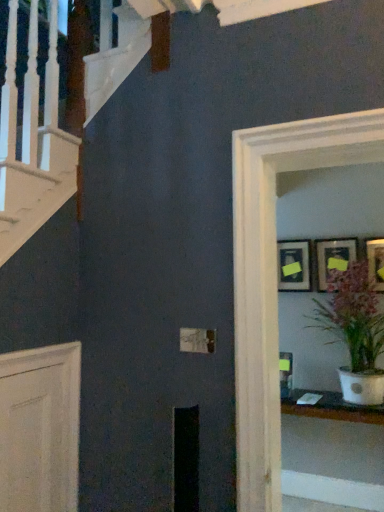
Question: Does matte black picture frame at upper right, which is the first picture frame from left to right, contain white glossy pot at center-right?

Choices:
 (A) yes
 (B) no

Answer: (B)

Question: Does matte black picture frame at upper right, which is the first picture frame from left to right, come behind white glossy pot at center-right?

Choices:
 (A) no
 (B) yes

Answer: (B)

Question: Considering the relative sizes of matte black picture frame at upper right, which is the first picture frame from left to right, and white glossy pot at center-right in the image provided, is matte black picture frame at upper right, which is the first picture frame from left to right, taller than white glossy pot at center-right?

Choices:
 (A) yes
 (B) no

Answer: (B)

Question: Considering the relative sizes of matte black picture frame at upper right, which is the first picture frame from left to right, and white glossy pot at center-right in the image provided, is matte black picture frame at upper right, which is the first picture frame from left to right, wider than white glossy pot at center-right?

Choices:
 (A) no
 (B) yes

Answer: (A)

Question: Are matte black picture frame at upper right, which is the first picture frame from left to right, and white glossy pot at center-right far apart?

Choices:
 (A) no
 (B) yes

Answer: (A)

Question: Does matte black picture frame at upper right, acting as the 3th picture frame starting from the right, have a lesser width compared to white glossy pot at center-right?

Choices:
 (A) no
 (B) yes

Answer: (B)

Question: From a real-world perspective, is white glossy glass door at upper right located beneath matte black picture frame at upper right, which is the first picture frame from left to right?

Choices:
 (A) yes
 (B) no

Answer: (A)

Question: Considering the relative positions of white glossy glass door at upper right and matte black picture frame at upper right, acting as the 3th picture frame starting from the right, in the image provided, is white glossy glass door at upper right in front of matte black picture frame at upper right, acting as the 3th picture frame starting from the right,?

Choices:
 (A) yes
 (B) no

Answer: (A)

Question: Is white glossy glass door at upper right shorter than matte black picture frame at upper right, which is the first picture frame from left to right?

Choices:
 (A) no
 (B) yes

Answer: (A)

Question: Is there a large distance between white glossy glass door at upper right and matte black picture frame at upper right, acting as the 3th picture frame starting from the right?

Choices:
 (A) yes
 (B) no

Answer: (A)

Question: Is white glossy glass door at upper right with matte black picture frame at upper right, which is the first picture frame from left to right?

Choices:
 (A) yes
 (B) no

Answer: (B)

Question: Is white glossy glass door at upper right aimed at matte black picture frame at upper right, which is the first picture frame from left to right?

Choices:
 (A) yes
 (B) no

Answer: (B)

Question: Considering the relative sizes of white glossy pot at center-right and matte black picture frame at upper right, the 1th picture frame viewed from the right, in the image provided, is white glossy pot at center-right bigger than matte black picture frame at upper right, the 1th picture frame viewed from the right,?

Choices:
 (A) no
 (B) yes

Answer: (B)